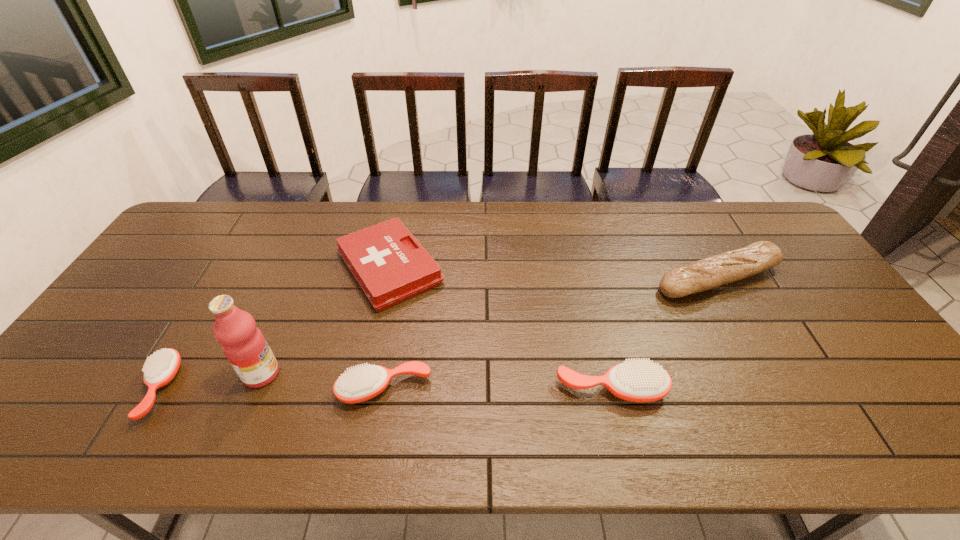
I want to click on vacant space at the near right corner, so click(893, 378).

Find the location of `free space between the tallest object and the rightmost object`. free space between the tallest object and the rightmost object is located at coordinates (490, 327).

Locate an element on the screen. This screenshot has width=960, height=540. free space between the baguet and the rightmost hairbrush is located at coordinates (664, 334).

The image size is (960, 540). Identify the location of free point between the baguet and the fifth object from left to right. (664, 334).

Where is `free area in between the first-aid kit and the shortest hairbrush`? This screenshot has height=540, width=960. free area in between the first-aid kit and the shortest hairbrush is located at coordinates (274, 328).

At what (x,y) coordinates should I click in order to perform the action: click on free space between the fifth object from left to right and the first-aid kit. Please return your answer as a coordinate pair (x, y). The image size is (960, 540). Looking at the image, I should click on (500, 329).

Find the location of a particular element. free space between the rightmost object and the first-aid kit is located at coordinates (554, 273).

Where is `empty space that is in between the first-aid kit and the second shortest hairbrush`? This screenshot has width=960, height=540. empty space that is in between the first-aid kit and the second shortest hairbrush is located at coordinates (387, 328).

Image resolution: width=960 pixels, height=540 pixels. Identify the location of unoccupied position between the first-aid kit and the leftmost hairbrush. (274, 328).

You are a GUI agent. You are given a task and a screenshot of the screen. Output one action in this format:
    pyautogui.click(x=<x>, y=<y>)
    Task: Click on the blank region between the first-aid kit and the fifth object from left to right
    This screenshot has width=960, height=540.
    Given the screenshot: What is the action you would take?
    pyautogui.click(x=500, y=329)